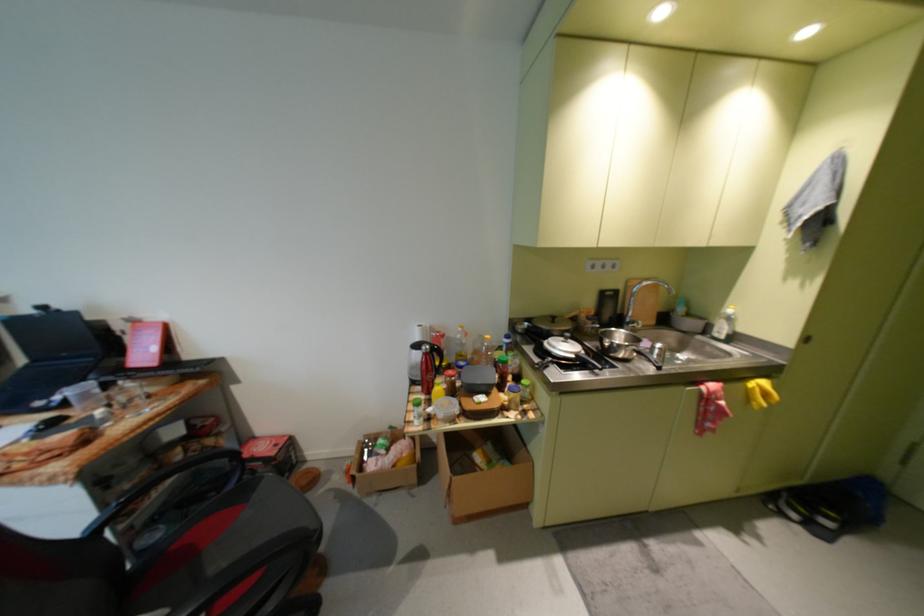
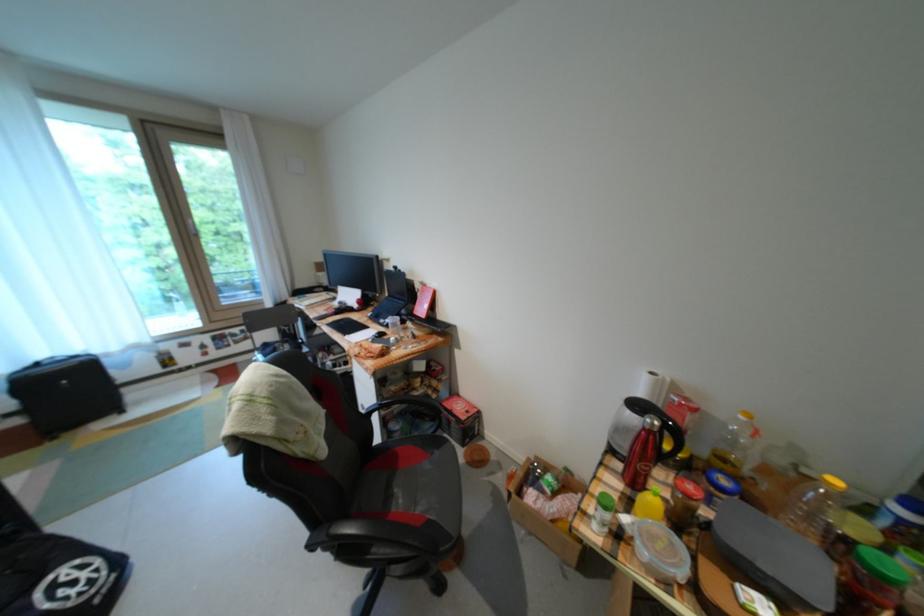
The point at (430, 326) is marked in the first image. Where is the corresponding point in the second image?

(662, 374)